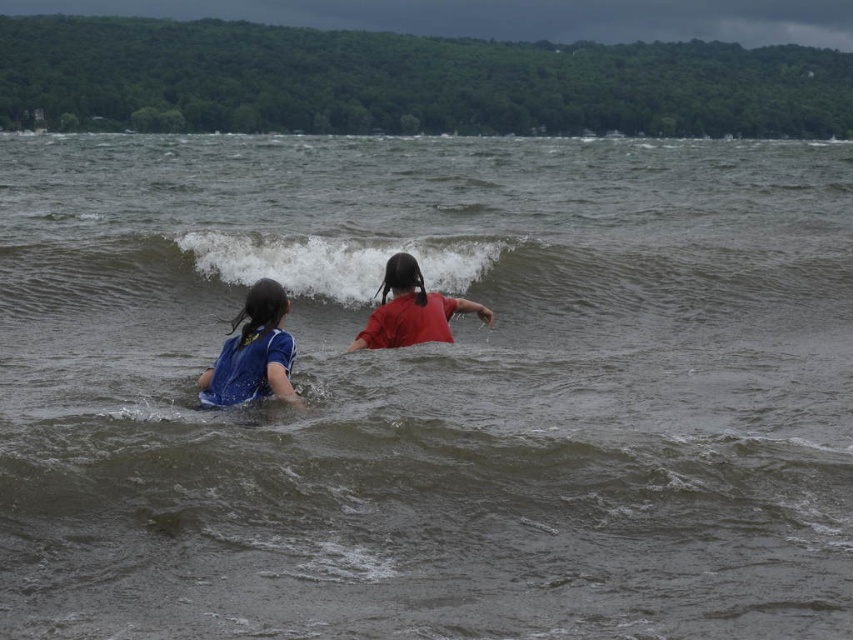
Question: Where is white frothy wave at center located in relation to blue fabric shirt at center in the image?

Choices:
 (A) left
 (B) right

Answer: (B)

Question: Among these objects, which one is farthest from the camera?

Choices:
 (A) blue fabric shirt at center
 (B) white frothy wave at center
 (C) red matte shirt at center

Answer: (B)

Question: Does blue fabric shirt at center have a greater width compared to red matte shirt at center?

Choices:
 (A) no
 (B) yes

Answer: (A)

Question: Estimate the real-world distances between objects in this image. Which object is farther from the red matte shirt at center?

Choices:
 (A) blue fabric shirt at center
 (B) white frothy wave at center

Answer: (B)

Question: Does white frothy wave at center appear over red matte shirt at center?

Choices:
 (A) no
 (B) yes

Answer: (B)

Question: Which point is farther to the camera?

Choices:
 (A) white frothy wave at center
 (B) red matte shirt at center

Answer: (A)